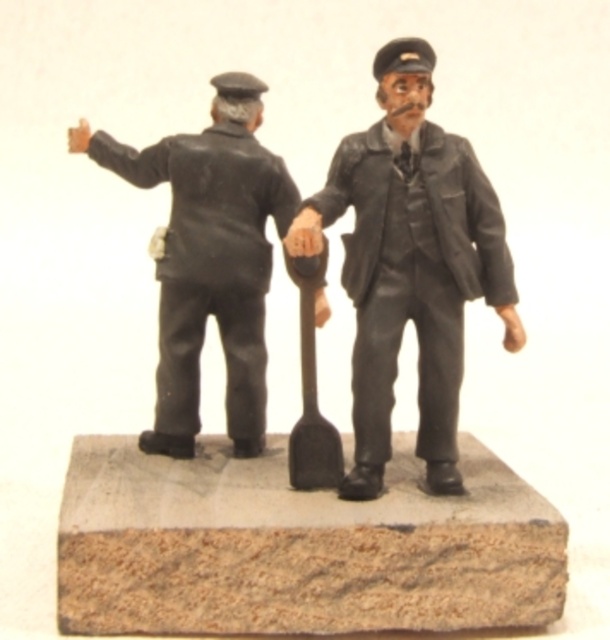
Which is behind, point (325, 563) or point (239, 232)?

The point (239, 232) is behind.

Measure the distance between brown wood at center and matte black figure at left.

A distance of 8.94 inches exists between brown wood at center and matte black figure at left.

Between point (265, 627) and point (198, 228), which one is positioned behind?

Point (198, 228)

Image resolution: width=610 pixels, height=640 pixels. Find the location of `brown wood at center`. brown wood at center is located at coordinates (298, 547).

Between brown wood at center and matte black uniform at center, which one is positioned lower?

brown wood at center is below.

Looking at this image, can you confirm if brown wood at center is taller than matte black uniform at center?

No, brown wood at center is not taller than matte black uniform at center.

The image size is (610, 640). Describe the element at coordinates (298, 547) in the screenshot. I see `brown wood at center` at that location.

The image size is (610, 640). In order to click on brown wood at center in this screenshot , I will do `click(298, 547)`.

Which is behind, point (127, 170) or point (310, 406)?

The point (127, 170) is more distant.

Is matte black figure at left thinner than metallic gray shovel at center?

In fact, matte black figure at left might be wider than metallic gray shovel at center.

Is point (165, 333) positioned after point (317, 460)?

Yes.

The width and height of the screenshot is (610, 640). What are the coordinates of `matte black figure at left` in the screenshot? It's located at (209, 259).